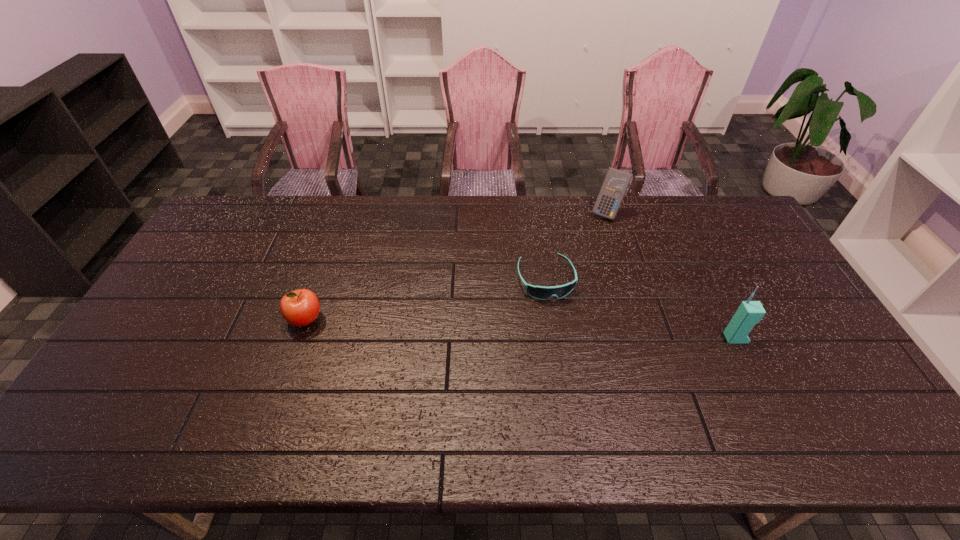
I want to click on free spot on the desktop that is between the apple and the rightmost object and is positioned on the front-facing side of the sunglasses, so tap(563, 330).

Where is `free space on the desktop that is between the apple and the cellular telephone and is positioned on the front-facing side of the farthest object`? This screenshot has height=540, width=960. free space on the desktop that is between the apple and the cellular telephone and is positioned on the front-facing side of the farthest object is located at coordinates (565, 330).